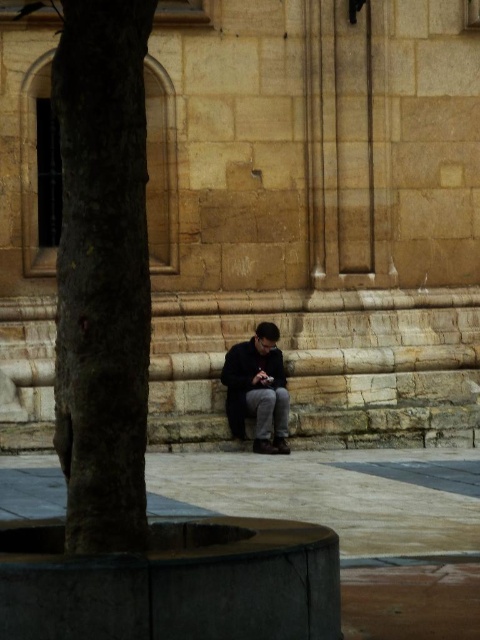
Does smooth brown tree trunk at left have a greater height compared to dark gray fabric jacket at center?

Indeed, smooth brown tree trunk at left has a greater height compared to dark gray fabric jacket at center.

Who is positioned more to the left, smooth brown tree trunk at left or dark gray fabric jacket at center?

Positioned to the left is smooth brown tree trunk at left.

Is point (132, 276) positioned in front of point (267, 444)?

That is True.

Where is `smooth brown tree trunk at left`? The height and width of the screenshot is (640, 480). smooth brown tree trunk at left is located at coordinates (103, 273).